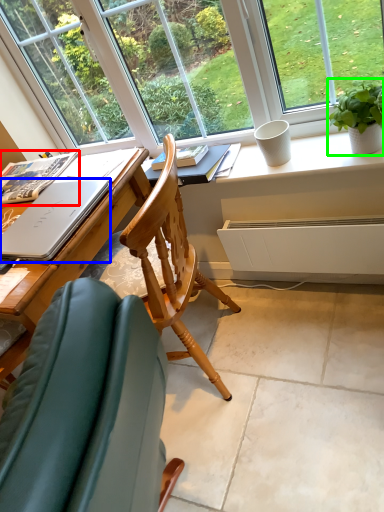
Question: Estimate the real-world distances between objects in this image. Which object is farther from book (highlighted by a red box), laptop (highlighted by a blue box) or houseplant (highlighted by a green box)?

Choices:
 (A) laptop
 (B) houseplant

Answer: (B)